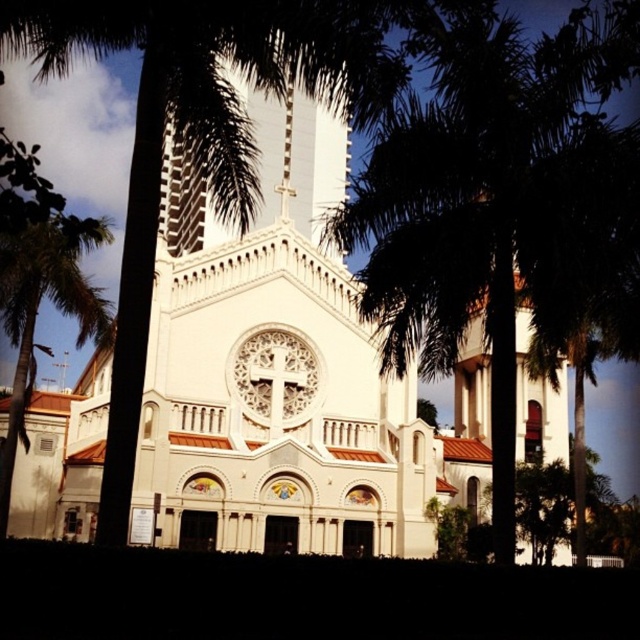
Question: Among these objects, which one is farthest from the camera?

Choices:
 (A) green leafy palm tree at center
 (B) white stone church at center
 (C) green leafy palm tree at left

Answer: (B)

Question: Which point appears closest to the camera in this image?

Choices:
 (A) (621, 83)
 (B) (275, 497)

Answer: (B)

Question: Which point is farther from the camera taking this photo?

Choices:
 (A) (598, 198)
 (B) (560, 371)

Answer: (B)

Question: Is white stone church at center thinner than green leafy palm tree at left?

Choices:
 (A) no
 (B) yes

Answer: (A)

Question: In this image, where is white stone church at center located relative to green leafy palm tree at center?

Choices:
 (A) below
 (B) above

Answer: (A)

Question: In this image, where is white stone church at center located relative to green leafy palm tree at center?

Choices:
 (A) left
 (B) right

Answer: (A)